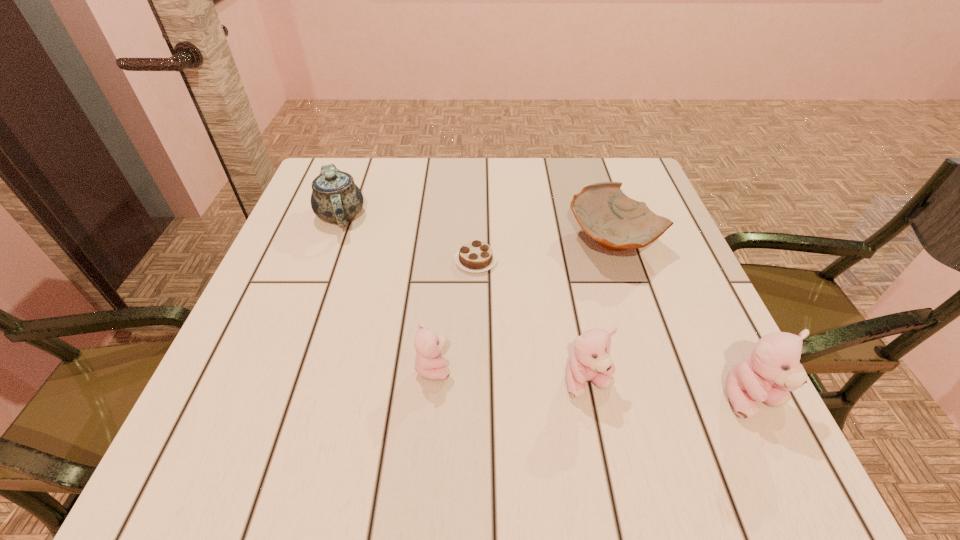
Find the location of a particular element. free space located from the spout of the leftmost object is located at coordinates (318, 278).

Locate an element on the screen. The height and width of the screenshot is (540, 960). object positioned at the far edge is located at coordinates (335, 198).

Identify the location of object located in the left edge section of the desktop. (335, 198).

Locate an element on the screen. teddy bear located at the right edge is located at coordinates (773, 368).

The width and height of the screenshot is (960, 540). I want to click on pottery at the right edge, so click(x=617, y=222).

At what (x,y) coordinates should I click in order to perform the action: click on object that is at the far left corner. Please return your answer as a coordinate pair (x, y). Looking at the image, I should click on (335, 198).

This screenshot has width=960, height=540. Find the location of `object located at the near right corner`. object located at the near right corner is located at coordinates (773, 368).

Find the location of `vacant space at the far edge`. vacant space at the far edge is located at coordinates (411, 166).

This screenshot has width=960, height=540. What are the coordinates of `free space at the near edge of the desktop` in the screenshot? It's located at (434, 384).

In the image, there is a desktop. Where is `vacant space at the left edge`? The height and width of the screenshot is (540, 960). vacant space at the left edge is located at coordinates point(285,295).